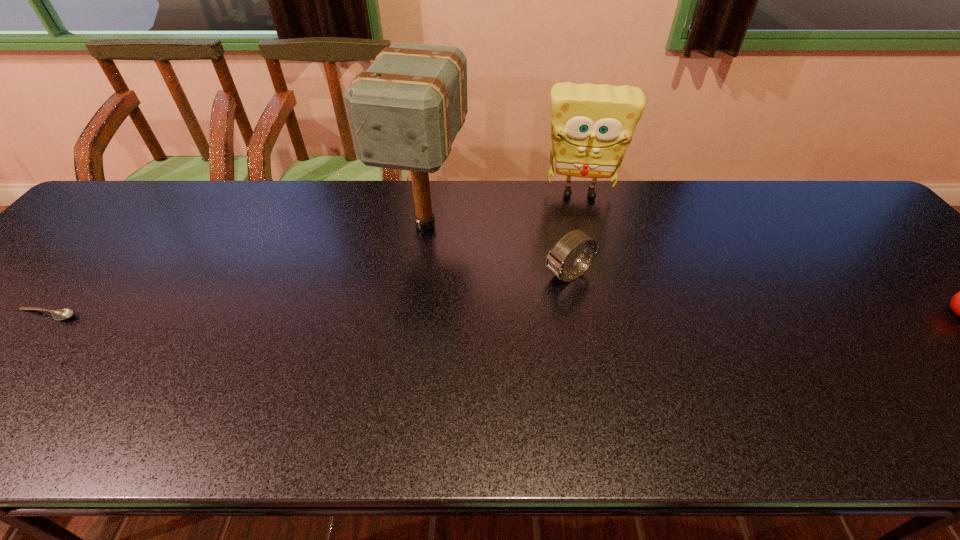
In the image, there is a desktop. Identify the location of vacant area at the near edge. (54, 367).

Find the location of a particular element. vacant region at the far left corner of the desktop is located at coordinates (109, 230).

Where is `free space between the mallet and the soupspoon`? The width and height of the screenshot is (960, 540). free space between the mallet and the soupspoon is located at coordinates (236, 270).

Find the location of a particular element. vacant space that is in between the sponge and the mallet is located at coordinates (503, 209).

Image resolution: width=960 pixels, height=540 pixels. In order to click on free spot between the fourth object from right to left and the soupspoon in this screenshot , I will do `click(236, 270)`.

Where is `free space between the tallest object and the sponge`? The image size is (960, 540). free space between the tallest object and the sponge is located at coordinates (503, 209).

Identify the location of object that is the closest to the leftmost object. (405, 110).

Locate an element on the screen. object that is the nearest to the leftmost object is located at coordinates (405, 110).

Locate an element on the screen. free region that satisfies the following two spatial constraints: 1. on the back side of the leftmost object; 2. on the right side of the watch is located at coordinates (82, 275).

The width and height of the screenshot is (960, 540). Find the location of `vacant space that satisfies the following two spatial constraints: 1. on the back side of the leftmost object; 2. on the right side of the watch`. vacant space that satisfies the following two spatial constraints: 1. on the back side of the leftmost object; 2. on the right side of the watch is located at coordinates (82, 275).